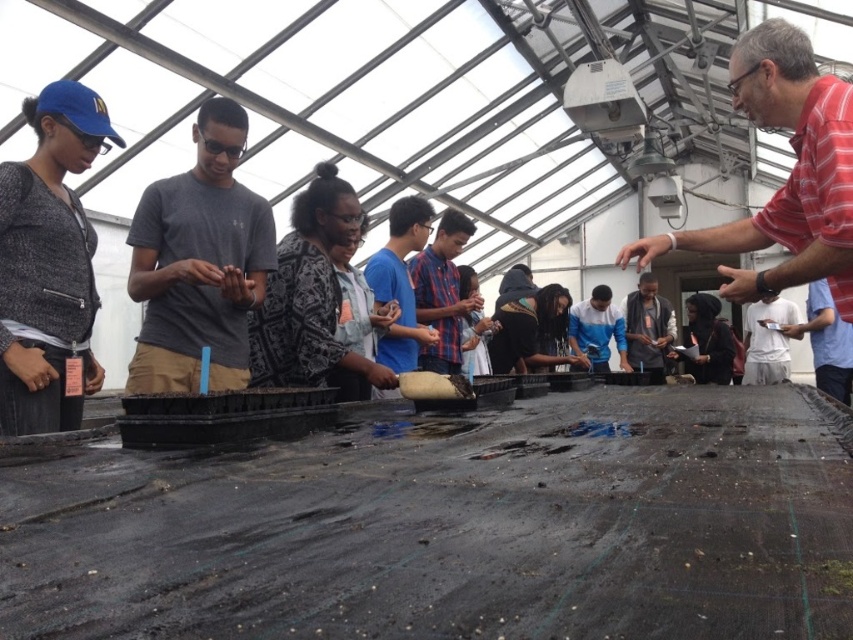
You are a photographer positioned at the entrance of the greenhouse. You want to take a photo of both the dark gray shirt at center and the blue fabric shirt at center. Which person should you focus on first if you start from the left side of the scene?

You should focus on the blue fabric shirt at center first because the dark gray shirt at center is to the right of it, meaning the blue fabric shirt at center is on the left side.

You are a gardener standing at the point marked by the coordinate point at (798, 164). You need to reach the seed trays located 1.92 meters away. If your arm can extend 1.5 meters, can you reach them without moving?

The seed trays are 1.92 meters away from the point at (798, 164). Since your arm can only extend 1.5 meters, you cannot reach them without moving closer.